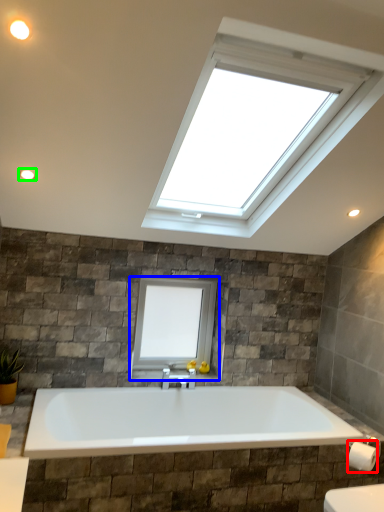
Question: Based on their relative distances, which object is farther from toilet paper (highlighted by a red box)? Choose from window (highlighted by a blue box) and light fixture (highlighted by a green box).

Choices:
 (A) window
 (B) light fixture

Answer: (B)